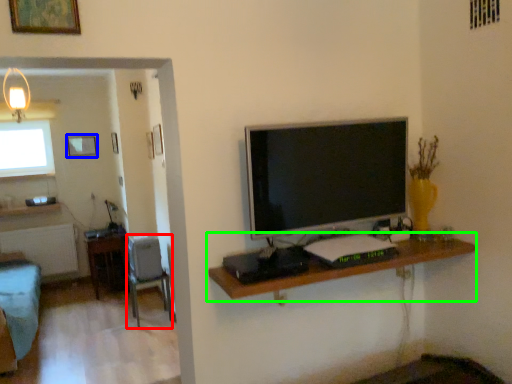
Question: Which object is positioned farthest from chair (highlighted by a red box)? Select from picture frame (highlighted by a blue box) and shelf (highlighted by a green box).

Choices:
 (A) picture frame
 (B) shelf

Answer: (B)